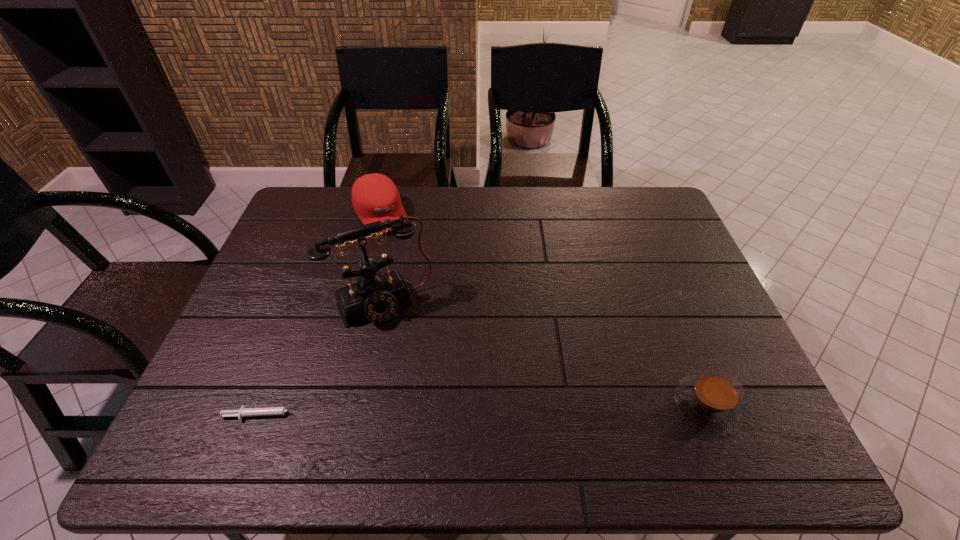
At what (x,y) coordinates should I click in order to perform the action: click on vacant space on the desktop that is between the syringe and the third tallest object and is positioned on the dial of the tallest object. Please return your answer as a coordinate pair (x, y). Looking at the image, I should click on (434, 411).

Where is `free spot on the desktop that is between the shortest object and the rightmost object and is positioned on the front-facing side of the cap`? Image resolution: width=960 pixels, height=540 pixels. free spot on the desktop that is between the shortest object and the rightmost object and is positioned on the front-facing side of the cap is located at coordinates (508, 410).